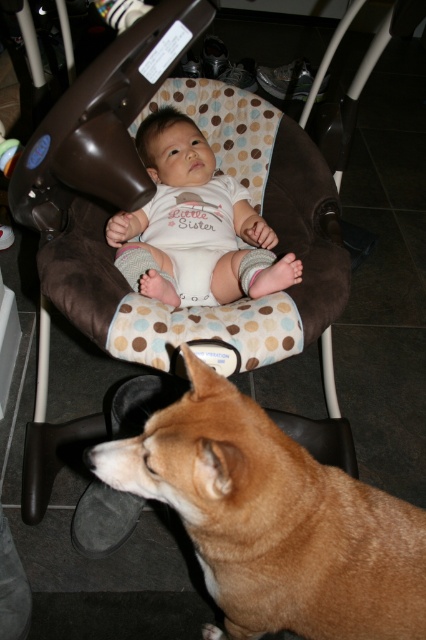
Can you confirm if brown fur dog at lower center is wider than white cotton onesie at center?

Correct, the width of brown fur dog at lower center exceeds that of white cotton onesie at center.

Find the location of a particular element. brown fur dog at lower center is located at coordinates (273, 520).

Who is more distant from viewer, (x=169, y=432) or (x=161, y=218)?

Point (x=161, y=218)

At what (x,y) coordinates should I click in order to perform the action: click on brown fur dog at lower center. Please return your answer as a coordinate pair (x, y). This screenshot has height=640, width=426. Looking at the image, I should click on (273, 520).

This screenshot has height=640, width=426. Find the location of `brown fabric baby carriage at upper center`. brown fabric baby carriage at upper center is located at coordinates (149, 196).

In order to click on brown fabric baby carriage at upper center in this screenshot , I will do `click(149, 196)`.

Does brown fabric baby carriage at upper center have a larger size compared to white cotton onesie at center?

Correct, brown fabric baby carriage at upper center is larger in size than white cotton onesie at center.

Is brown fabric baby carriage at upper center to the right of white cotton onesie at center from the viewer's perspective?

Indeed, brown fabric baby carriage at upper center is positioned on the right side of white cotton onesie at center.

Is point (94, 536) less distant than point (184, 236)?

That is True.

Image resolution: width=426 pixels, height=640 pixels. Identify the location of brown fabric baby carriage at upper center. (149, 196).